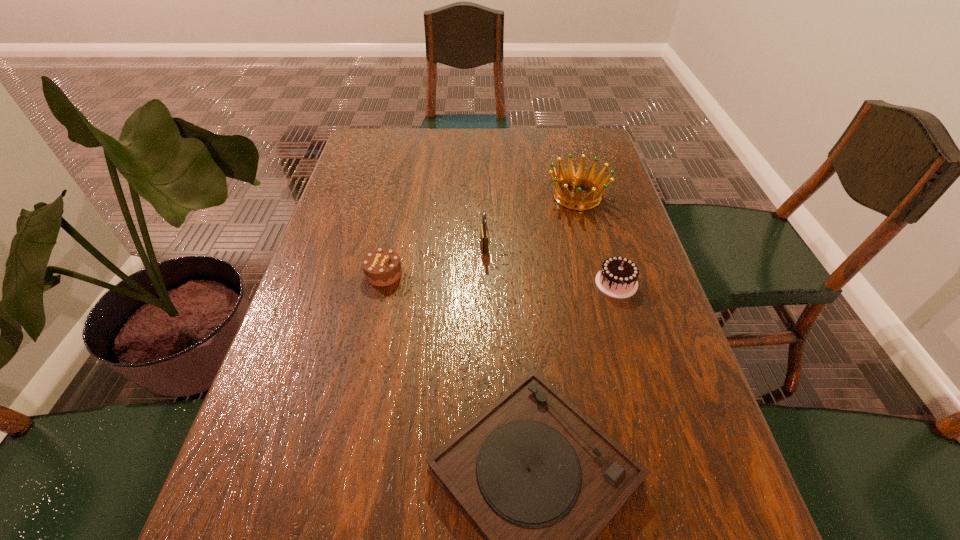
Where is `object that is at the left edge`? object that is at the left edge is located at coordinates (382, 267).

Image resolution: width=960 pixels, height=540 pixels. Identify the location of crown that is at the right edge. (564, 180).

Locate an element on the screen. chocolate cake positioned at the right edge is located at coordinates (618, 276).

In the image, there is a desktop. In order to click on free space at the left edge in this screenshot , I will do `click(302, 364)`.

The height and width of the screenshot is (540, 960). Find the location of `free space at the right edge`. free space at the right edge is located at coordinates (692, 438).

The height and width of the screenshot is (540, 960). In the image, there is a desktop. What are the coordinates of `vacant area at the far left corner` in the screenshot? It's located at (396, 144).

The height and width of the screenshot is (540, 960). In the image, there is a desktop. In order to click on vacant space at the far right corner in this screenshot , I will do `click(590, 133)`.

Where is `empty location between the left chocolate cake and the right chocolate cake`? Image resolution: width=960 pixels, height=540 pixels. empty location between the left chocolate cake and the right chocolate cake is located at coordinates (500, 278).

At what (x,y) coordinates should I click in order to perform the action: click on empty space between the farthest object and the right chocolate cake. Please return your answer as a coordinate pair (x, y). The width and height of the screenshot is (960, 540). Looking at the image, I should click on (597, 240).

This screenshot has height=540, width=960. What are the coordinates of `unoccupied position between the tallest object and the farthest object` in the screenshot? It's located at (531, 221).